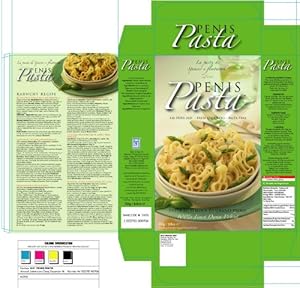
The image size is (300, 288). What are the coordinates of `fork` in the screenshot? It's located at (208, 113).